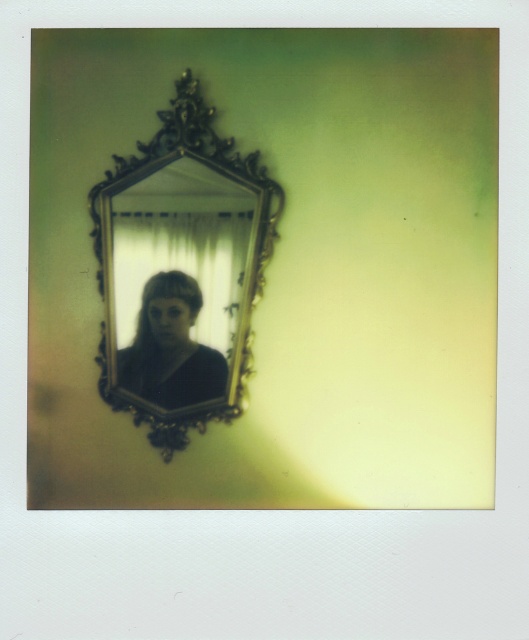
You are an interior designer analyzing the layout of this vintage Polaroid photo. The gold ornate mirror at center is positioned at coordinates 0.425, 0.342. If you want to place a decorative vase exactly 0.1 units to the right of the mirror, what are the coordinates where the vase should be placed?

To place the decorative vase exactly 0.1 units to the right of the gold ornate mirror at center, the new coordinates would be calculated by adding 0.1 to the x coordinate of the mirror. The original coordinates are [180,272]. Adding 0.1 to the x value gives 0.525, so the vase should be placed at coordinates [180,336].

You are an interior designer arranging a room and see the gold ornate mirror at center and the matte black hair at center in the image. Which object is positioned higher up in the scene?

The gold ornate mirror at center is above matte black hair at center, so it is positioned higher up in the scene.

You are an interior designer looking to place a new decorative item in the room shown. The gold ornate mirror at center and the matte black hair at center are already present. Which object should you place closer to the viewer if you want the decorative item to be in front of both?

The gold ornate mirror at center is in front of the matte black hair at center. To place the decorative item in front of both, you should position it closer to the viewer than the gold ornate mirror at center.